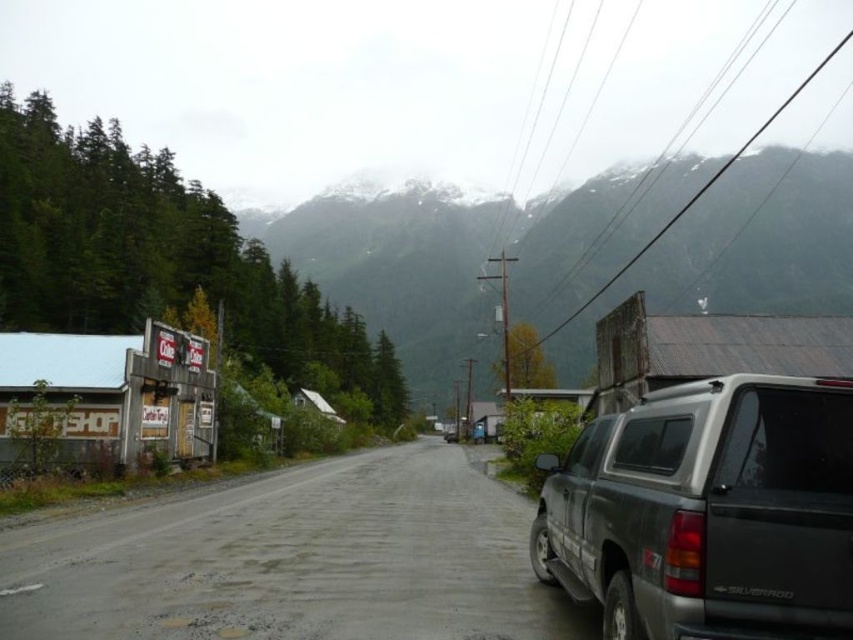
You are standing at the point marked by the coordinate point at (x=741, y=250) in this rural scene. Looking around, you see a Chevrolet Silverado pickup truck parked on the right side of the road and old buildings with faded signs on the left. Which direction should you walk to reach the snowy rock mountain at upper center?

The point at coordinate (x=741, y=250) is the snowy rock mountain at upper center itself, so you are already at the snowy rock mountain at upper center.